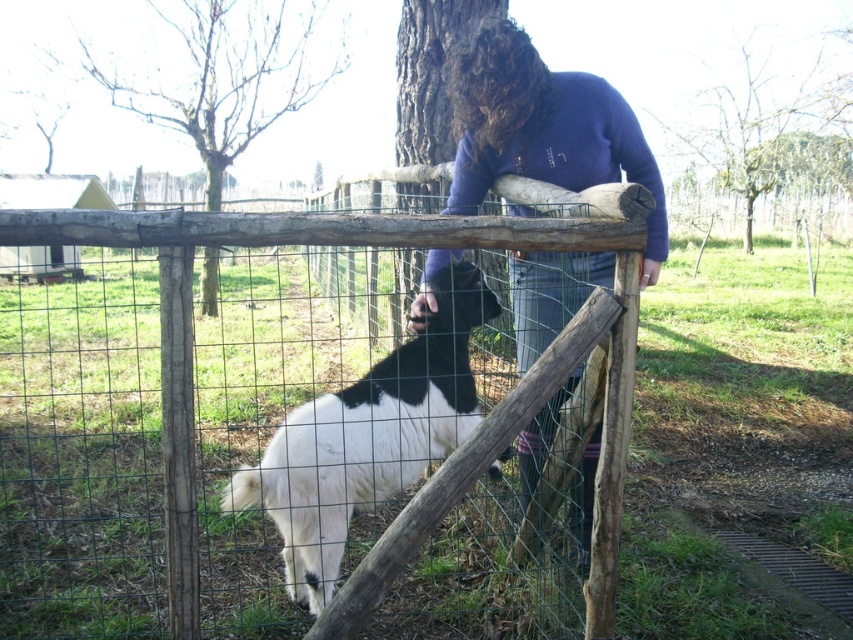
Is wooden fence at center to the left of black and white fur at center from the viewer's perspective?

Yes, wooden fence at center is to the left of black and white fur at center.

Does wooden fence at center appear under black and white fur at center?

No, wooden fence at center is not below black and white fur at center.

Is point (386, 484) positioned behind point (367, 458)?

Yes.

You are a GUI agent. You are given a task and a screenshot of the screen. Output one action in this format:
    pyautogui.click(x=<x>, y=<y>)
    Task: Click on the wooden fence at center
    The height and width of the screenshot is (640, 853).
    Given the screenshot: What is the action you would take?
    pyautogui.click(x=281, y=419)

Consider the image. Does purple fleece sweater at center have a lesser height compared to black and white fur at center?

Incorrect, purple fleece sweater at center's height does not fall short of black and white fur at center's.

Between point (457, 196) and point (309, 609), which one is positioned behind?

Point (457, 196)

The image size is (853, 640). What do you see at coordinates (543, 129) in the screenshot? I see `purple fleece sweater at center` at bounding box center [543, 129].

This screenshot has height=640, width=853. What are the coordinates of `purple fleece sweater at center` in the screenshot? It's located at (543, 129).

Is point (6, 474) more distant than point (492, 81)?

Yes, point (6, 474) is farther from viewer.

Can you confirm if wooden fence at center is taller than purple fleece sweater at center?

Correct, wooden fence at center is much taller as purple fleece sweater at center.

Locate an element on the screen. The height and width of the screenshot is (640, 853). wooden fence at center is located at coordinates (281, 419).